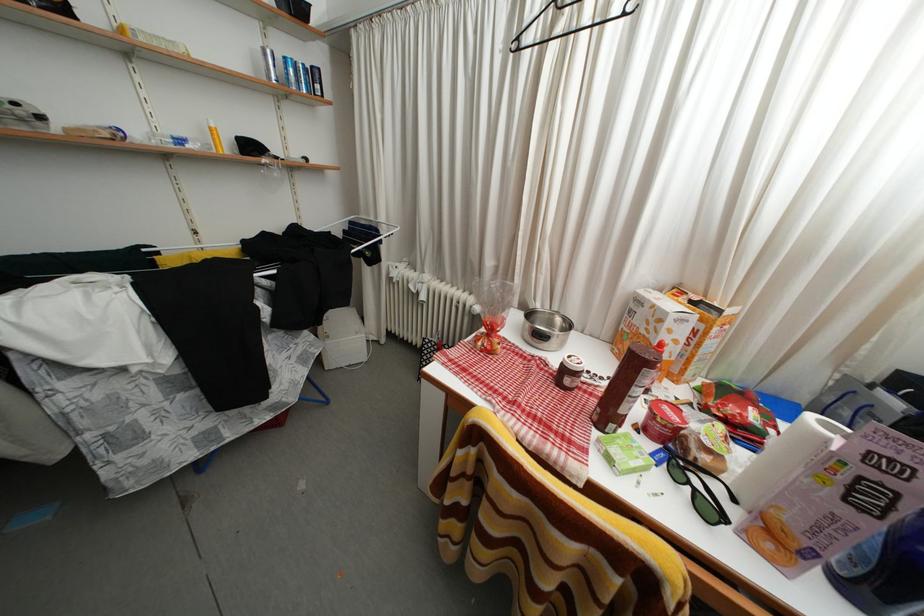
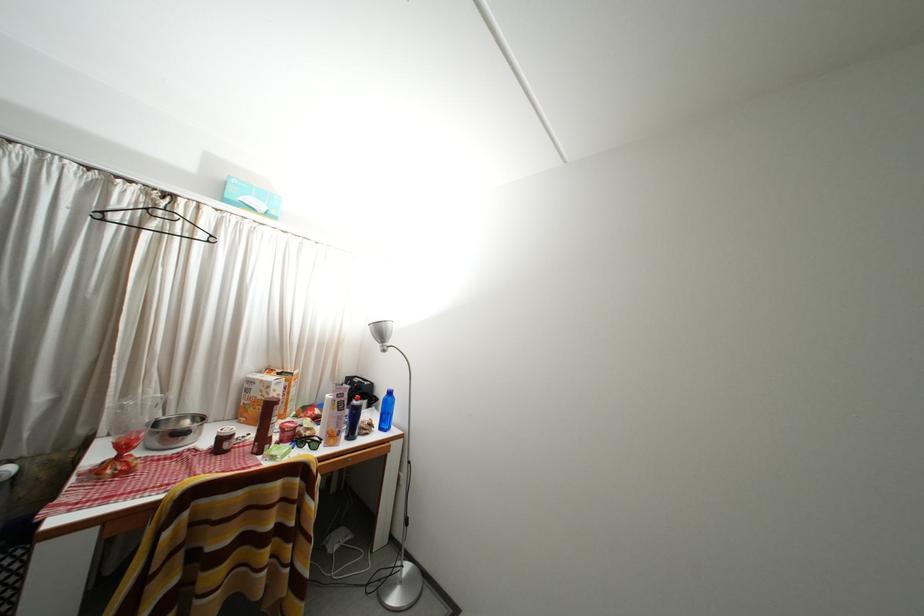
The point at [566,33] is marked in the first image. Where is the corresponding point in the second image?

(161, 230)